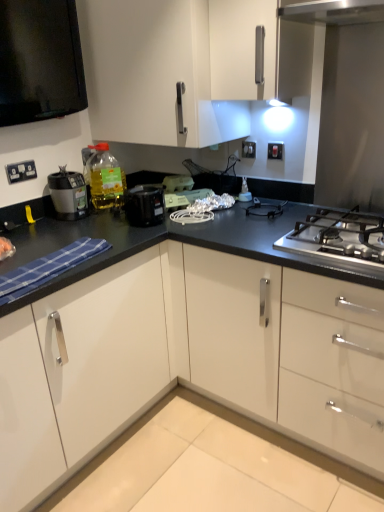
The image size is (384, 512). I want to click on metallic silver toaster at center, marked as the 2th appliance in a right-to-left arrangement, so click(182, 191).

Image resolution: width=384 pixels, height=512 pixels. Find the location of `clear plastic spray bottle at center, placed as the first appliance when sorted from right to left`. clear plastic spray bottle at center, placed as the first appliance when sorted from right to left is located at coordinates (245, 192).

Measure the distance between black plastic coffee maker at upper left, which is the first kitchen appliance from right to left, and camera.

A distance of 5.94 feet exists between black plastic coffee maker at upper left, which is the first kitchen appliance from right to left, and camera.

How much space does black plastic coffee maker at upper left, which is the first kitchen appliance from right to left, occupy vertically?

black plastic coffee maker at upper left, which is the first kitchen appliance from right to left, is 6.05 inches tall.

What do you see at coordinates (248, 149) in the screenshot? The width and height of the screenshot is (384, 512). I see `white plastic electric outlet at upper center, the 1th electric outlet when ordered from top to bottom` at bounding box center [248, 149].

Describe the element at coordinates (21, 170) in the screenshot. I see `white plastic electrical outlet at upper left, the 3th electric outlet in the back-to-front sequence` at that location.

Based on the photo, how much space does white plastic electrical outlet at upper left, acting as the third electric outlet starting from the top, occupy horizontally?

It is 0.52 inches.

Where is `metallic silver toaster at center, marked as the 2th appliance in a right-to-left arrangement`? metallic silver toaster at center, marked as the 2th appliance in a right-to-left arrangement is located at coordinates 182,191.

Looking at this image, is clear plastic spray bottle at center, the 3th appliance when ordered from left to right, at the back of matte black blender at left, placed as the second kitchen appliance when sorted from right to left?

That's not correct — matte black blender at left, placed as the second kitchen appliance when sorted from right to left, is not looking away from clear plastic spray bottle at center, the 3th appliance when ordered from left to right.

Which of these two, matte black blender at left, placed as the second kitchen appliance when sorted from right to left, or clear plastic spray bottle at center, the 3th appliance when ordered from left to right, is smaller?

clear plastic spray bottle at center, the 3th appliance when ordered from left to right, is smaller.

Which is less distant, (83,181) or (239,198)?

The point (83,181) is closer to the camera.

From a real-world perspective, is matte black blender at left, placed as the second kitchen appliance when sorted from right to left, physically below clear plastic spray bottle at center, the 3th appliance when ordered from left to right?

Incorrect, from a real-world perspective, matte black blender at left, placed as the second kitchen appliance when sorted from right to left, is higher than clear plastic spray bottle at center, the 3th appliance when ordered from left to right.

Choose the correct answer: Is stainless steel gas stove at center right inside black plastic coffee maker at upper left, which is the first kitchen appliance from right to left, or outside it?

stainless steel gas stove at center right is spatially situated outside black plastic coffee maker at upper left, which is the first kitchen appliance from right to left.

Considering the relative positions of stainless steel gas stove at center right and black plastic coffee maker at upper left, which is counted as the 2th kitchen appliance, starting from the left, in the image provided, is stainless steel gas stove at center right to the right of black plastic coffee maker at upper left, which is counted as the 2th kitchen appliance, starting from the left, from the viewer's perspective?

Indeed, stainless steel gas stove at center right is positioned on the right side of black plastic coffee maker at upper left, which is counted as the 2th kitchen appliance, starting from the left.

The height and width of the screenshot is (512, 384). I want to click on gas stove located on the right of black plastic coffee maker at upper left, which is the first kitchen appliance from right to left, so click(338, 237).

In the scene shown: Who is taller, stainless steel gas stove at center right or black plastic coffee maker at upper left, which is counted as the 2th kitchen appliance, starting from the left?

black plastic coffee maker at upper left, which is counted as the 2th kitchen appliance, starting from the left.

Is white plastic electric outlet at upper center, which is counted as the 2th electric outlet, starting from the right, surrounded by translucent plastic bottle at upper left?

Actually, white plastic electric outlet at upper center, which is counted as the 2th electric outlet, starting from the right, is outside translucent plastic bottle at upper left.

Looking at this image, can you confirm if translucent plastic bottle at upper left is wider than white plastic electric outlet at upper center, the 3th electric outlet in the front-to-back sequence?

Indeed, translucent plastic bottle at upper left has a greater width compared to white plastic electric outlet at upper center, the 3th electric outlet in the front-to-back sequence.

Is translucent plastic bottle at upper left placed right next to white plastic electric outlet at upper center, acting as the 1th electric outlet starting from the back?

There is a gap between translucent plastic bottle at upper left and white plastic electric outlet at upper center, acting as the 1th electric outlet starting from the back.

Could you tell me if black plastic coffee maker at upper left, which is counted as the 2th kitchen appliance, starting from the left, is turned towards matte black blender at left, the 1th kitchen appliance when ordered from left to right?

No, black plastic coffee maker at upper left, which is counted as the 2th kitchen appliance, starting from the left, is not turned towards matte black blender at left, the 1th kitchen appliance when ordered from left to right.

Is matte black blender at left, placed as the second kitchen appliance when sorted from right to left, inside black plastic coffee maker at upper left, which is the first kitchen appliance from right to left?

No.

Does black plastic coffee maker at upper left, which is counted as the 2th kitchen appliance, starting from the left, touch matte black blender at left, the 1th kitchen appliance when ordered from left to right?

No, black plastic coffee maker at upper left, which is counted as the 2th kitchen appliance, starting from the left, is not making contact with matte black blender at left, the 1th kitchen appliance when ordered from left to right.

Would you consider white plastic electric outlet at upper center, which is the third electric outlet in bottom-to-top order, to be distant from clear plastic spray bottle at center, placed as the first appliance when sorted from right to left?

white plastic electric outlet at upper center, which is the third electric outlet in bottom-to-top order, is actually quite close to clear plastic spray bottle at center, placed as the first appliance when sorted from right to left.

Considering the positions of point (249, 144) and point (245, 198), is point (249, 144) closer or farther from the camera than point (245, 198)?

Clearly, point (249, 144) is more distant from the camera than point (245, 198).

Consider the image. How many degrees apart are the facing directions of white plastic electric outlet at upper center, the 3th electric outlet in the front-to-back sequence, and clear plastic spray bottle at center, the 3th appliance when ordered from left to right?

white plastic electric outlet at upper center, the 3th electric outlet in the front-to-back sequence, and clear plastic spray bottle at center, the 3th appliance when ordered from left to right, are facing 0.23 degrees away from each other.

Considering the sizes of white plastic electric outlet at upper center, which is counted as the 2th electric outlet, starting from the right, and clear plastic spray bottle at center, the 3th appliance when ordered from left to right, in the image, is white plastic electric outlet at upper center, which is counted as the 2th electric outlet, starting from the right, bigger or smaller than clear plastic spray bottle at center, the 3th appliance when ordered from left to right,?

Clearly, white plastic electric outlet at upper center, which is counted as the 2th electric outlet, starting from the right, is smaller in size than clear plastic spray bottle at center, the 3th appliance when ordered from left to right.

Who is more distant, white plastic switch at upper center, which ranks as the third electric outlet in left-to-right order, or black plastic coffee maker at upper left, which is counted as the 2th kitchen appliance, starting from the left?

white plastic switch at upper center, which ranks as the third electric outlet in left-to-right order.

Considering the sizes of objects white plastic switch at upper center, acting as the 2th electric outlet starting from the bottom, and black plastic coffee maker at upper left, which is the first kitchen appliance from right to left, in the image provided, who is taller, white plastic switch at upper center, acting as the 2th electric outlet starting from the bottom, or black plastic coffee maker at upper left, which is the first kitchen appliance from right to left,?

Standing taller between the two is black plastic coffee maker at upper left, which is the first kitchen appliance from right to left.

Based on the photo, is the surface of white plastic switch at upper center, which is the first electric outlet in right-to-left order, in direct contact with black plastic coffee maker at upper left, which is counted as the 2th kitchen appliance, starting from the left?

white plastic switch at upper center, which is the first electric outlet in right-to-left order, is not next to black plastic coffee maker at upper left, which is counted as the 2th kitchen appliance, starting from the left, and they're not touching.

From the image's perspective, is white plastic switch at upper center, acting as the 2th electric outlet starting from the bottom, located above or below black plastic coffee maker at upper left, which is counted as the 2th kitchen appliance, starting from the left?

Clearly, from the image's perspective, white plastic switch at upper center, acting as the 2th electric outlet starting from the bottom, is above black plastic coffee maker at upper left, which is counted as the 2th kitchen appliance, starting from the left.

Is matte black blender at left, placed as the second kitchen appliance when sorted from right to left, touching white glossy cabinet at upper center?

No.

From the image's perspective, is matte black blender at left, placed as the second kitchen appliance when sorted from right to left, located above white glossy cabinet at upper center?

No.

In terms of width, does matte black blender at left, placed as the second kitchen appliance when sorted from right to left, look wider or thinner when compared to white glossy cabinet at upper center?

In the image, matte black blender at left, placed as the second kitchen appliance when sorted from right to left, appears to be more narrow than white glossy cabinet at upper center.

What are the coordinates of `the 1st appliance above the matte black blender at left, placed as the second kitchen appliance when sorted from right to left (from the image's perspective)` in the screenshot? It's located at (245, 192).

This screenshot has height=512, width=384. In order to click on gas stove below the black plastic coffee maker at upper left, which is counted as the 2th kitchen appliance, starting from the left (from the image's perspective) in this screenshot , I will do `click(338, 237)`.

Based on their spatial positions, is white plastic toaster at center, placed as the 3th appliance when sorted from right to left, or black plastic coffee maker at upper left, which is counted as the 2th kitchen appliance, starting from the left, further from translucent plastic bottle at upper left?

Among the two, white plastic toaster at center, placed as the 3th appliance when sorted from right to left, is located further to translucent plastic bottle at upper left.

Which object lies further to the anchor point translucent plastic bottle at upper left, white plastic toaster at center, acting as the first appliance starting from the left, or metallic silver toaster at center, marked as the 2th appliance in a right-to-left arrangement?

metallic silver toaster at center, marked as the 2th appliance in a right-to-left arrangement, is positioned further to the anchor translucent plastic bottle at upper left.

When comparing their distances from white plastic switch at upper center, marked as the 2th electric outlet in a front-to-back arrangement, does stainless steel gas stove at center right or matte black blender at left, the 1th kitchen appliance when ordered from left to right, seem closer?

stainless steel gas stove at center right lies closer to white plastic switch at upper center, marked as the 2th electric outlet in a front-to-back arrangement, than the other object.

Based on their spatial positions, is white plastic switch at upper center, which is the first electric outlet in right-to-left order, or translucent plastic bottle at upper left closer to metallic silver toaster at center, positioned as the 2th appliance in left-to-right order?

translucent plastic bottle at upper left is closer to metallic silver toaster at center, positioned as the 2th appliance in left-to-right order.

From the image, which object appears to be nearer to translucent plastic bottle at upper left, matte black blender at left, placed as the second kitchen appliance when sorted from right to left, or clear plastic spray bottle at center, placed as the first appliance when sorted from right to left?

Based on the image, matte black blender at left, placed as the second kitchen appliance when sorted from right to left, appears to be nearer to translucent plastic bottle at upper left.

Considering their positions, is white plastic electrical outlet at upper left, acting as the third electric outlet starting from the top, positioned closer to stainless steel gas stove at center right than black plastic coffee maker at upper left, which is counted as the 2th kitchen appliance, starting from the left?

The object closer to stainless steel gas stove at center right is black plastic coffee maker at upper left, which is counted as the 2th kitchen appliance, starting from the left.

Based on their spatial positions, is white plastic electric outlet at upper center, the 3th electric outlet in the front-to-back sequence, or metallic silver toaster at center, positioned as the 2th appliance in left-to-right order, closer to matte black blender at left, the 1th kitchen appliance when ordered from left to right?

metallic silver toaster at center, positioned as the 2th appliance in left-to-right order, lies closer to matte black blender at left, the 1th kitchen appliance when ordered from left to right, than the other object.

Which object lies nearer to the anchor point clear plastic spray bottle at center, placed as the first appliance when sorted from right to left, white plastic toaster at center, acting as the first appliance starting from the left, or white plastic switch at upper center, the 2th electric outlet positioned from the top?

white plastic switch at upper center, the 2th electric outlet positioned from the top, is closer to clear plastic spray bottle at center, placed as the first appliance when sorted from right to left.

At what (x,y) coordinates should I click in order to perform the action: click on bottle between white plastic electrical outlet at upper left, the 3th electric outlet when ordered from right to left, and stainless steel gas stove at center right from left to right. Please return your answer as a coordinate pair (x, y). The image size is (384, 512). Looking at the image, I should click on (105, 178).

I want to click on electric outlet between metallic silver toaster at center, positioned as the 2th appliance in left-to-right order, and white plastic switch at upper center, marked as the 2th electric outlet in a front-to-back arrangement, in the horizontal direction, so click(x=248, y=149).

Image resolution: width=384 pixels, height=512 pixels. What are the coordinates of `appliance situated between white plastic electrical outlet at upper left, acting as the third electric outlet starting from the top, and white glossy cabinet at upper center from left to right` in the screenshot? It's located at (177, 183).

Locate an element on the screen. This screenshot has width=384, height=512. cabinetry between stainless steel gas stove at center right and white plastic electric outlet at upper center, the 1th electric outlet when ordered from top to bottom, along the z-axis is located at coordinates (153, 74).